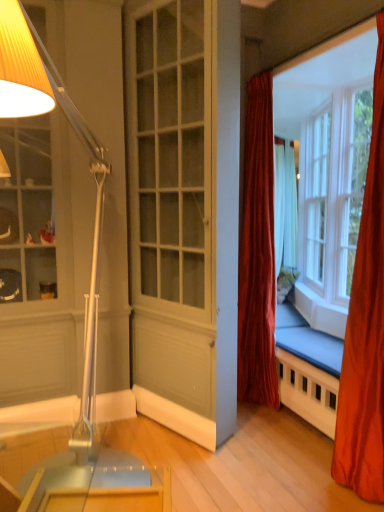
Locate an element on the screen. This screenshot has width=384, height=512. vacant region to the right of white painted wood screen door at center is located at coordinates (268, 441).